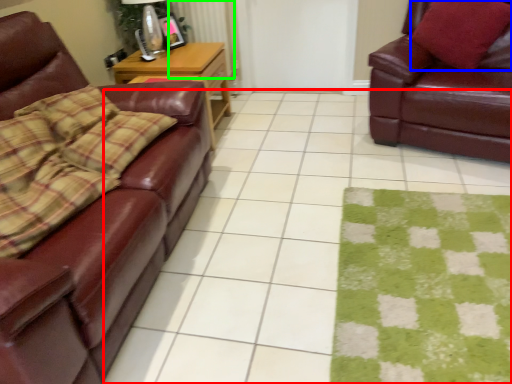
Question: Which is farther away from square (highlighted by a red box)? throw pillow (highlighted by a blue box) or radiator (highlighted by a green box)?

Choices:
 (A) throw pillow
 (B) radiator

Answer: (B)